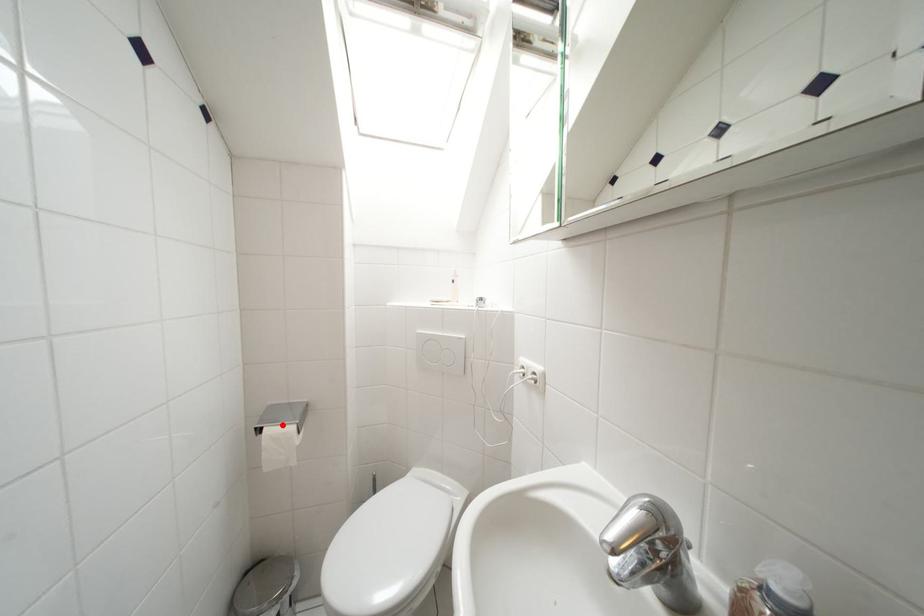
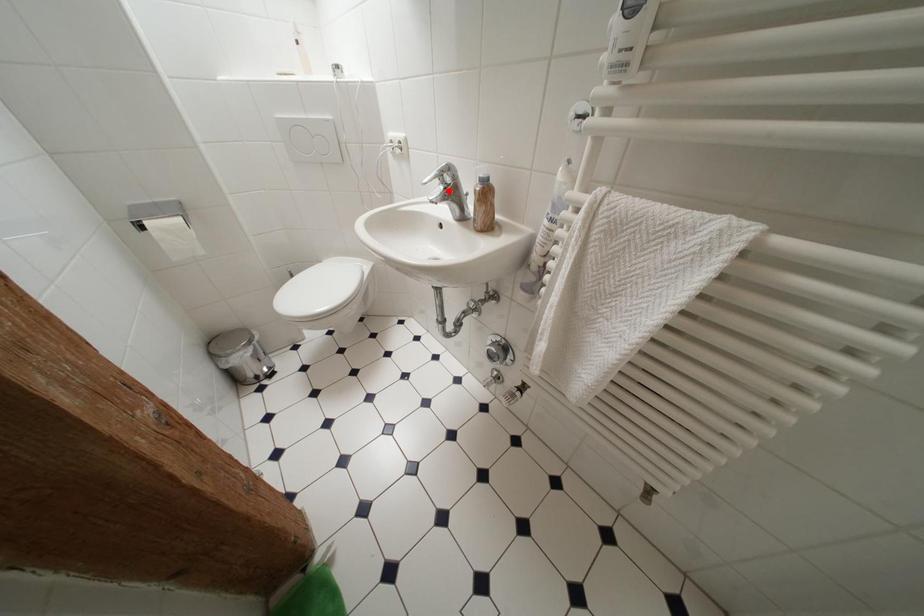
I am providing you with two images of the same scene from different viewpoints. A red point is marked on the first image and another point is marked on the second image. Are the points marked in image1 and image2 representing the same 3D position?

No